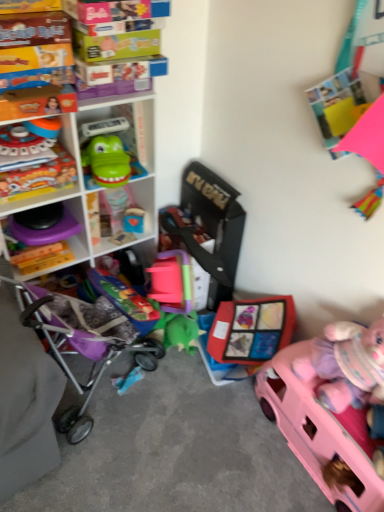
Find the location of a particular element. free space above green rubber toy at center-left, the 3th toy viewed from the left (from a real-world perspective) is located at coordinates (105, 132).